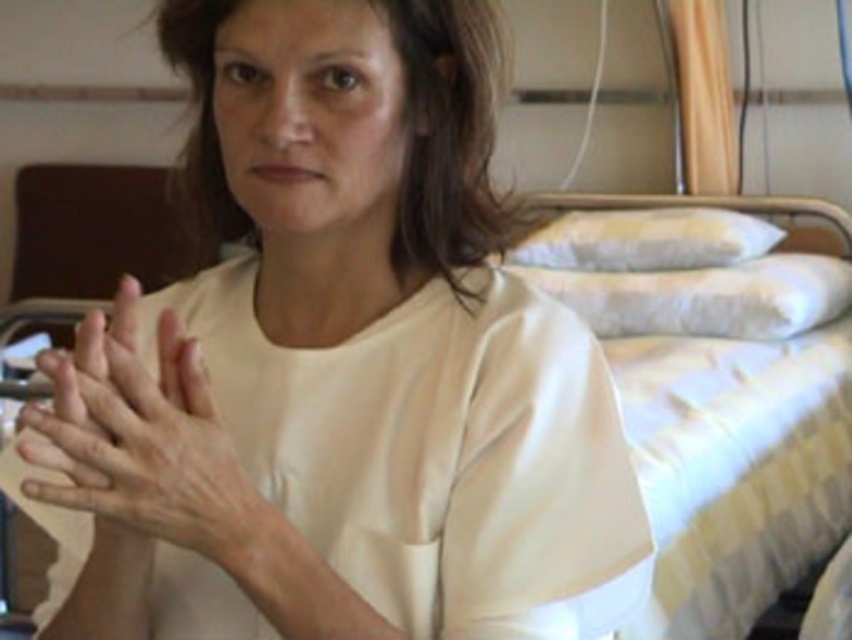
You are a nurse checking on a patient in the hospital. You notice the dry skin hands at center and the yellow striped pillow at upper right. Which object is closer to you?

The dry skin hands at center is closer to the viewer than the yellow striped pillow at upper right.